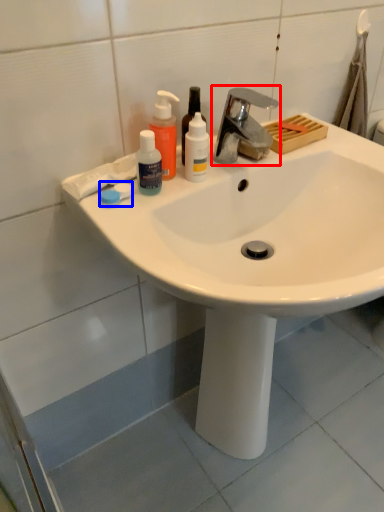
Question: Which of the following is the closest to the observer, tap (highlighted by a red box) or soap (highlighted by a blue box)?

Choices:
 (A) tap
 (B) soap

Answer: (A)